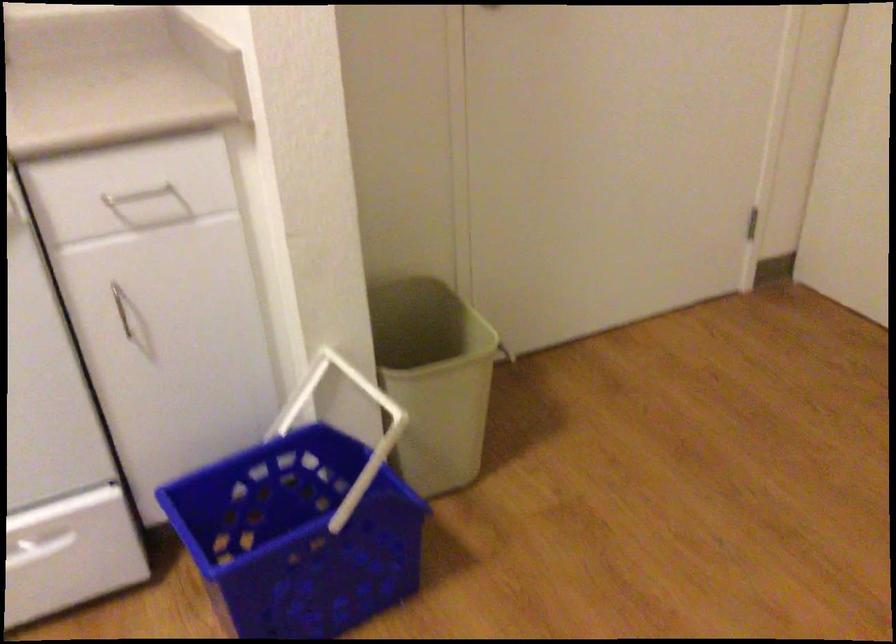
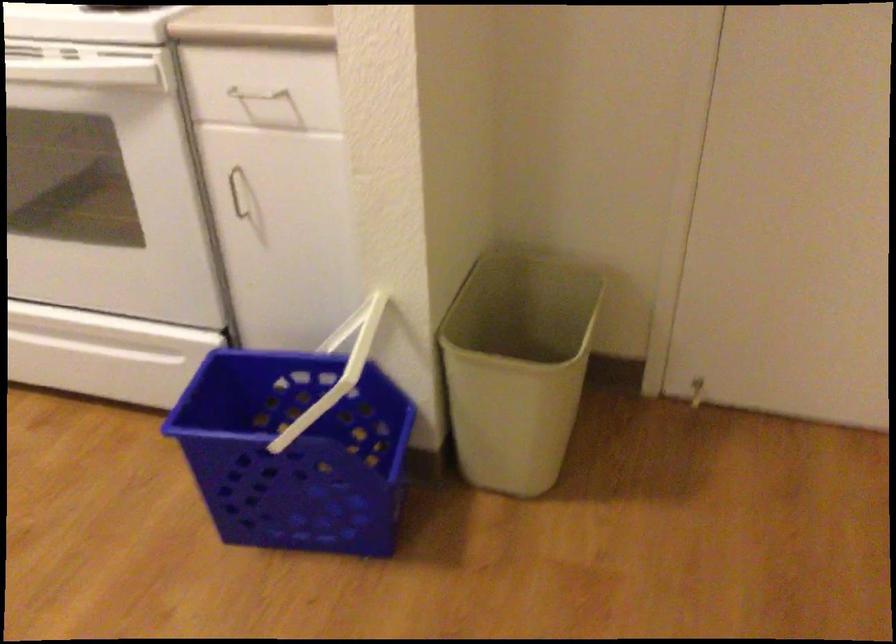
The point at (117, 308) is marked in the first image. Where is the corresponding point in the second image?

(237, 192)